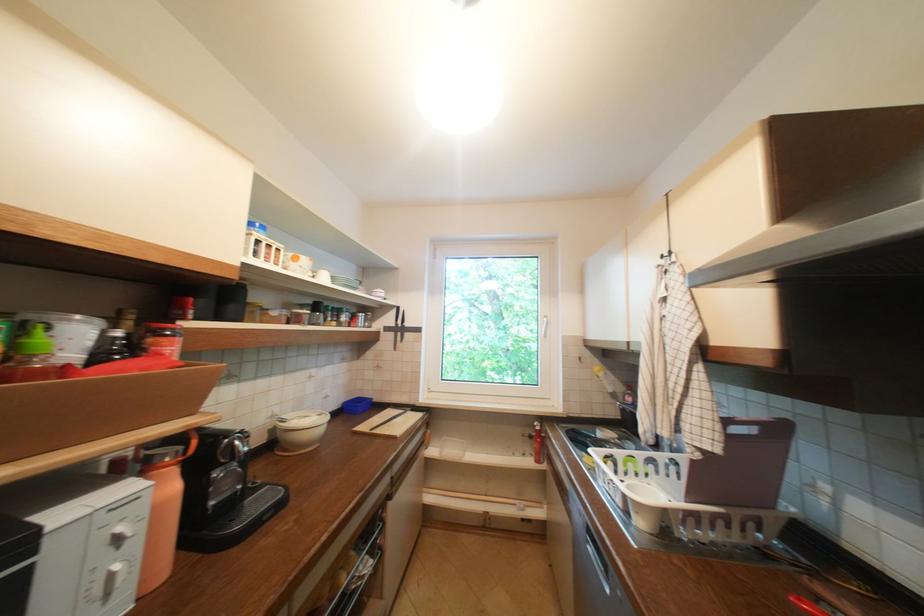
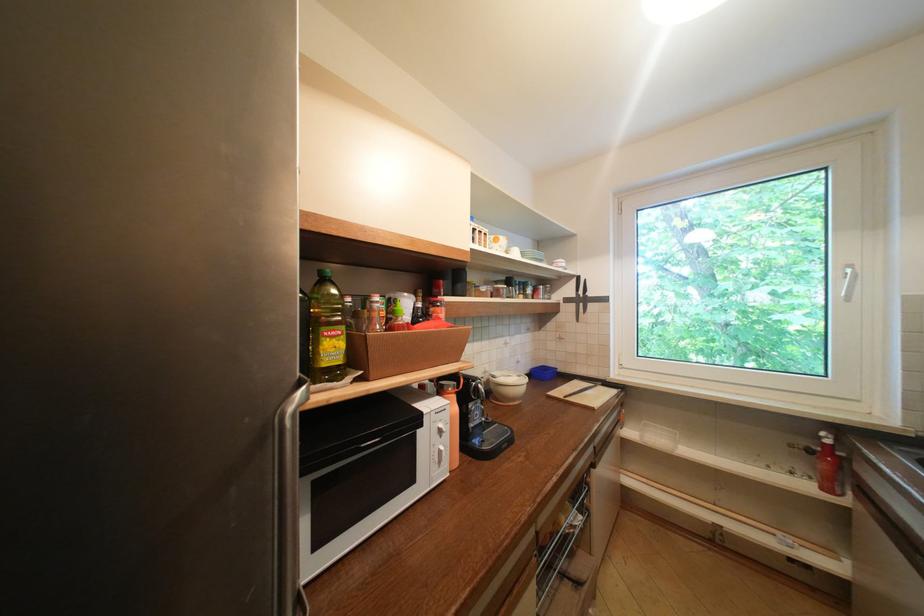
Question: I am providing you with two images of the same scene from different viewpoints. Please identify which objects are invisible in image2.

Choices:
 (A) metal drawer handle
 (B) black handle knife
 (C) microwave door handle
 (D) none of these

Answer: (D)